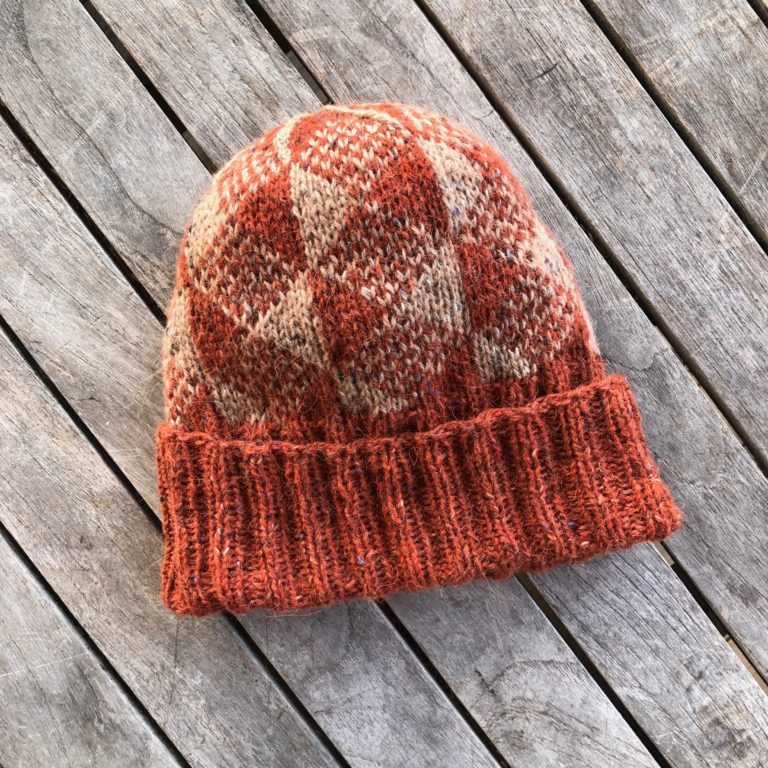
You are a GUI agent. You are given a task and a screenshot of the screen. Output one action in this format:
    pyautogui.click(x=<x>, y=<y>)
    Task: Click on the bench
    
    Given the screenshot: What is the action you would take?
    pyautogui.click(x=88, y=346)